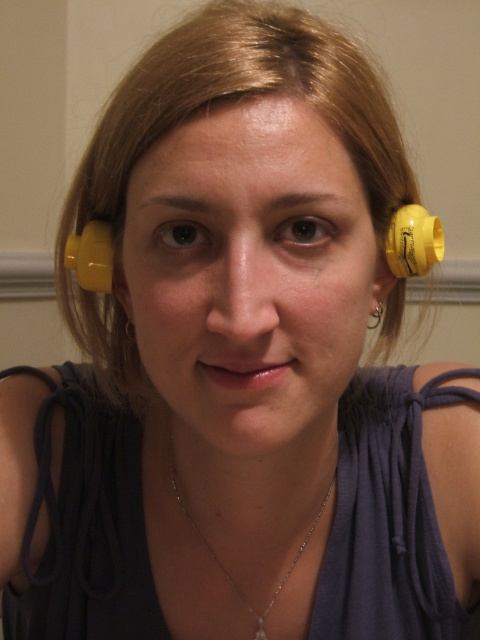
Question: From the image, what is the correct spatial relationship of yellow matte ear at right in relation to silver metallic ring at ear?

Choices:
 (A) below
 (B) above

Answer: (B)

Question: Which point is farther from the camera taking this photo?

Choices:
 (A) (380, 250)
 (B) (122, 289)
 (C) (380, 301)
 (D) (179, 500)

Answer: (D)

Question: Considering the relative positions of silver chain necklace at center and yellow matte ear at left in the image provided, where is silver chain necklace at center located with respect to yellow matte ear at left?

Choices:
 (A) right
 (B) left

Answer: (A)

Question: Is yellow matte ear at right bigger than yellow matte ear at left?

Choices:
 (A) no
 (B) yes

Answer: (B)

Question: Which point appears closest to the camera in this image?

Choices:
 (A) (379, 317)
 (B) (121, 292)
 (C) (324, 499)

Answer: (B)

Question: Among these points, which one is nearest to the camera?

Choices:
 (A) (304, 545)
 (B) (111, 291)
 (C) (388, 276)
 (D) (377, 310)

Answer: (C)